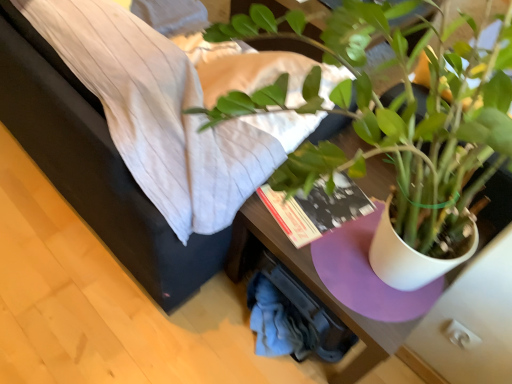
What do you see at coordinates (405, 120) in the screenshot? I see `green matte plant at center` at bounding box center [405, 120].

Where is `green matte plant at center`? The width and height of the screenshot is (512, 384). green matte plant at center is located at coordinates (405, 120).

You are a GUI agent. You are given a task and a screenshot of the screen. Output one action in this format:
    pyautogui.click(x=<x>, y=<y>)
    Task: Click on the white textured sheet at upper center
    
    Given the screenshot: What is the action you would take?
    pyautogui.click(x=180, y=103)

Measure the distance between point (204, 12) and camera.

They are 1.31 meters apart.

This screenshot has height=384, width=512. What do you see at coordinates (180, 103) in the screenshot?
I see `white textured sheet at upper center` at bounding box center [180, 103].

Image resolution: width=512 pixels, height=384 pixels. Find the location of `green matte plant at center`. green matte plant at center is located at coordinates (405, 120).

Is white textured sheet at upper center at the right side of green matte plant at center?

Incorrect, white textured sheet at upper center is not on the right side of green matte plant at center.

Is white textured sheet at upper center positioned in front of green matte plant at center?

No, white textured sheet at upper center is behind green matte plant at center.

Which is closer to the camera, (80, 73) or (340, 17)?

The point (340, 17) is more forward.

From the image's perspective, which one is positioned higher, white textured sheet at upper center or green matte plant at center?

white textured sheet at upper center.

From a real-world perspective, which is physically below, white textured sheet at upper center or green matte plant at center?

From a 3D spatial view, white textured sheet at upper center is below.

Can you confirm if white textured sheet at upper center is thinner than green matte plant at center?

Incorrect, the width of white textured sheet at upper center is not less than that of green matte plant at center.

Looking at this image, who is shorter, white textured sheet at upper center or green matte plant at center?

Standing shorter between the two is white textured sheet at upper center.

Does white textured sheet at upper center have a smaller size compared to green matte plant at center?

Incorrect, white textured sheet at upper center is not smaller in size than green matte plant at center.

Choose the correct answer: Is white textured sheet at upper center inside green matte plant at center or outside it?

white textured sheet at upper center cannot be found inside green matte plant at center.

Are white textured sheet at upper center and green matte plant at center beside each other?

white textured sheet at upper center and green matte plant at center are clearly separated.

Is white textured sheet at upper center looking in the opposite direction of green matte plant at center?

No, green matte plant at center is not at the back of white textured sheet at upper center.

What's the angular difference between white textured sheet at upper center and green matte plant at center's facing directions?

There is a 8.75e-05-degree angle between the facing directions of white textured sheet at upper center and green matte plant at center.

Locate an element on the screen. sheet above the green matte plant at center (from the image's perspective) is located at coordinates (180, 103).

Based on the photo, is green matte plant at center at the right side of white textured sheet at upper center?

Yes, green matte plant at center is to the right of white textured sheet at upper center.

Which object is closer to the camera, green matte plant at center or white textured sheet at upper center?

green matte plant at center is in front.

Does point (362, 93) come behind point (200, 105)?

No.

From the image's perspective, does green matte plant at center appear higher than white textured sheet at upper center?

Incorrect, from the image's perspective, green matte plant at center is lower than white textured sheet at upper center.

From a real-world perspective, who is located higher, green matte plant at center or white textured sheet at upper center?

From a 3D spatial view, green matte plant at center is above.

Is green matte plant at center thinner than white textured sheet at upper center?

Yes.

Considering the relative sizes of green matte plant at center and white textured sheet at upper center in the image provided, is green matte plant at center taller than white textured sheet at upper center?

Indeed, green matte plant at center has a greater height compared to white textured sheet at upper center.

Can you confirm if green matte plant at center is smaller than white textured sheet at upper center?

Yes, green matte plant at center is smaller than white textured sheet at upper center.

Which is correct: green matte plant at center is inside white textured sheet at upper center, or outside of it?

green matte plant at center cannot be found inside white textured sheet at upper center.

Are green matte plant at center and white textured sheet at upper center making contact?

No, green matte plant at center is not touching white textured sheet at upper center.

Looking at this image, is green matte plant at center facing towards white textured sheet at upper center?

No.

How different are the orientations of green matte plant at center and white textured sheet at upper center in degrees?

The angular difference between green matte plant at center and white textured sheet at upper center is 8.75e-05 degrees.

This screenshot has height=384, width=512. I want to click on sheet that is on the left side of green matte plant at center, so click(x=180, y=103).

Image resolution: width=512 pixels, height=384 pixels. I want to click on houseplant that is in front of the white textured sheet at upper center, so click(x=405, y=120).

At what (x,y) coordinates should I click in order to perform the action: click on sheet located above the green matte plant at center (from the image's perspective). Please return your answer as a coordinate pair (x, y). Looking at the image, I should click on (180, 103).